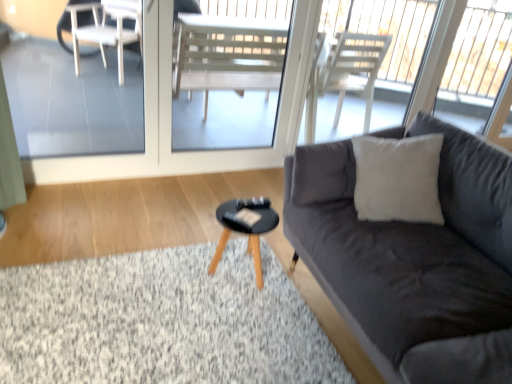
Question: Is dark gray fabric couch at right shorter than transparent glass screen door at upper center?

Choices:
 (A) yes
 (B) no

Answer: (A)

Question: Is dark gray fabric couch at right facing towards transparent glass screen door at upper center?

Choices:
 (A) yes
 (B) no

Answer: (B)

Question: From a real-world perspective, is dark gray fabric couch at right beneath transparent glass screen door at upper center?

Choices:
 (A) yes
 (B) no

Answer: (A)

Question: Does dark gray fabric couch at right have a larger size compared to transparent glass screen door at upper center?

Choices:
 (A) yes
 (B) no

Answer: (A)

Question: Considering the relative sizes of dark gray fabric couch at right and transparent glass screen door at upper center in the image provided, is dark gray fabric couch at right taller than transparent glass screen door at upper center?

Choices:
 (A) no
 (B) yes

Answer: (A)

Question: Would you say soft gray carpet at lower left is inside or outside dark gray fabric couch at right?

Choices:
 (A) outside
 (B) inside

Answer: (A)

Question: From a real-world perspective, is soft gray carpet at lower left physically located above or below dark gray fabric couch at right?

Choices:
 (A) above
 (B) below

Answer: (B)

Question: From their relative heights in the image, would you say soft gray carpet at lower left is taller or shorter than dark gray fabric couch at right?

Choices:
 (A) tall
 (B) short

Answer: (B)

Question: From the image's perspective, is soft gray carpet at lower left positioned above or below dark gray fabric couch at right?

Choices:
 (A) above
 (B) below

Answer: (B)

Question: Does point (264, 162) appear closer or farther from the camera than point (355, 218)?

Choices:
 (A) farther
 (B) closer

Answer: (A)

Question: Visually, is transparent glass screen door at upper center positioned to the left or to the right of dark gray fabric couch at right?

Choices:
 (A) left
 (B) right

Answer: (A)

Question: From a real-world perspective, is transparent glass screen door at upper center positioned above or below dark gray fabric couch at right?

Choices:
 (A) below
 (B) above

Answer: (B)

Question: Considering their positions, is transparent glass screen door at upper center located in front of or behind dark gray fabric couch at right?

Choices:
 (A) behind
 (B) front

Answer: (A)

Question: From a real-world perspective, is black wooden coffee table at center above or below transparent glass screen door at upper center?

Choices:
 (A) below
 (B) above

Answer: (A)

Question: Considering the relative positions of black wooden coffee table at center and transparent glass screen door at upper center in the image provided, is black wooden coffee table at center to the left or to the right of transparent glass screen door at upper center?

Choices:
 (A) right
 (B) left

Answer: (A)